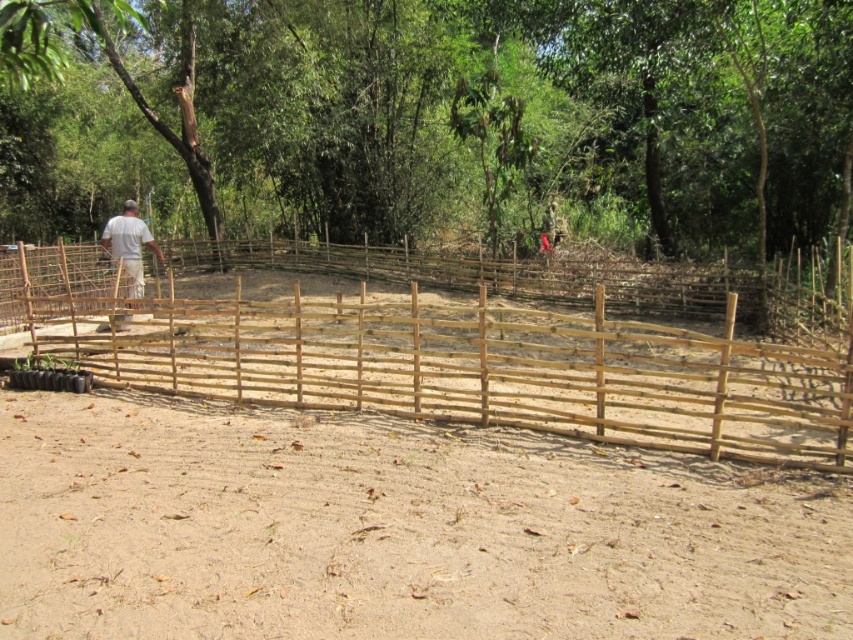
Between brown sandy dirt field at center and natural wood fence at center, which one has less height?

brown sandy dirt field at center is shorter.

Between brown sandy dirt field at center and natural wood fence at center, which one is positioned higher?

natural wood fence at center is higher up.

Where is `brown sandy dirt field at center`? Image resolution: width=853 pixels, height=640 pixels. brown sandy dirt field at center is located at coordinates (393, 531).

This screenshot has width=853, height=640. I want to click on brown sandy dirt field at center, so click(x=393, y=531).

Does brown wood fence at center come in front of brown sandy dirt field at center?

No, it is behind brown sandy dirt field at center.

I want to click on brown wood fence at center, so click(x=442, y=129).

This screenshot has height=640, width=853. Identify the location of brown wood fence at center. (442, 129).

Does brown sandy dirt field at center have a larger size compared to white wood person at left?

Incorrect, brown sandy dirt field at center is not larger than white wood person at left.

Is point (608, 504) positioned after point (123, 204)?

No, it is in front of (123, 204).

Where is `brown sandy dirt field at center`? Image resolution: width=853 pixels, height=640 pixels. brown sandy dirt field at center is located at coordinates (393, 531).